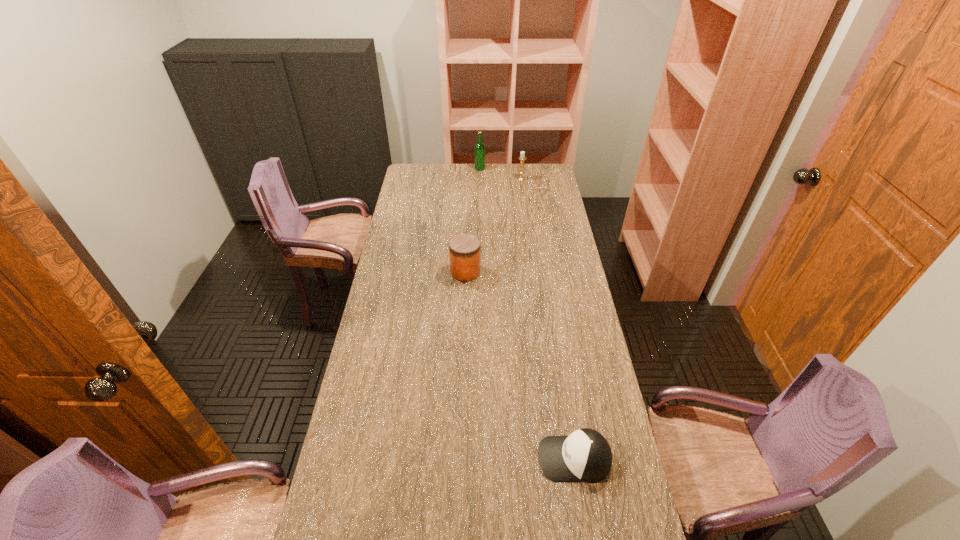
Where is `beer bottle`? This screenshot has height=540, width=960. beer bottle is located at coordinates (479, 150).

Identify the location of the tallest object. (479, 150).

Find the location of `candle holder`. candle holder is located at coordinates (522, 157).

The image size is (960, 540). Identify the location of the third farthest object. (464, 249).

What are the coordinates of `the shortest object` in the screenshot? It's located at (585, 455).

The image size is (960, 540). I want to click on cap, so click(x=585, y=455).

Find the location of a particular element. free space located 0.250m on the front of the farthest object is located at coordinates (480, 197).

The height and width of the screenshot is (540, 960). I want to click on free space located on the left of the candle holder, so tap(489, 179).

Locate an element on the screen. vacant space located on the front of the third farthest object is located at coordinates (462, 364).

You are a GUI agent. You are given a task and a screenshot of the screen. Output one action in this format:
    pyautogui.click(x=<x>, y=<y>)
    Task: Click on the vacant area situated on the front panel of the cap
    The height and width of the screenshot is (540, 960).
    Given the screenshot: What is the action you would take?
    pyautogui.click(x=510, y=458)